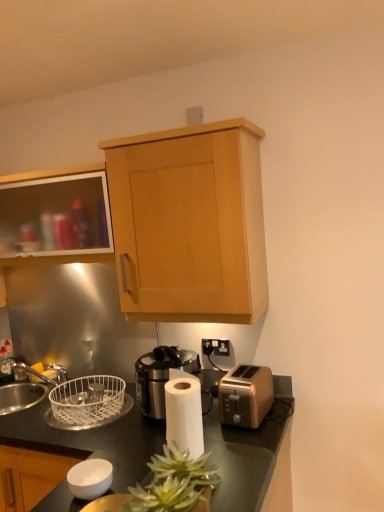
Question: Is matte glass cabinet at upper left, which appears as the first cabinetry when viewed from the left, taller than light wood cabinet at upper center, the 1th cabinetry positioned from the right?

Choices:
 (A) no
 (B) yes

Answer: (A)

Question: Does matte glass cabinet at upper left, which ranks as the 2th cabinetry in right-to-left order, turn towards light wood cabinet at upper center, marked as the 2th cabinetry in a left-to-right arrangement?

Choices:
 (A) yes
 (B) no

Answer: (B)

Question: Is matte glass cabinet at upper left, which appears as the first cabinetry when viewed from the left, not close to light wood cabinet at upper center, marked as the 2th cabinetry in a left-to-right arrangement?

Choices:
 (A) no
 (B) yes

Answer: (A)

Question: Considering the relative sizes of matte glass cabinet at upper left, which appears as the first cabinetry when viewed from the left, and light wood cabinet at upper center, marked as the 2th cabinetry in a left-to-right arrangement, in the image provided, is matte glass cabinet at upper left, which appears as the first cabinetry when viewed from the left, thinner than light wood cabinet at upper center, marked as the 2th cabinetry in a left-to-right arrangement,?

Choices:
 (A) yes
 (B) no

Answer: (A)

Question: Can you confirm if matte glass cabinet at upper left, which ranks as the 2th cabinetry in right-to-left order, is smaller than light wood cabinet at upper center, the 1th cabinetry positioned from the right?

Choices:
 (A) yes
 (B) no

Answer: (A)

Question: From a real-world perspective, is black plastic electrical outlet at center physically located above or below black glossy countertop at center?

Choices:
 (A) below
 (B) above

Answer: (B)

Question: Visually, is black plastic electrical outlet at center positioned to the left or to the right of black glossy countertop at center?

Choices:
 (A) left
 (B) right

Answer: (B)

Question: From the image's perspective, is black plastic electrical outlet at center above or below black glossy countertop at center?

Choices:
 (A) below
 (B) above

Answer: (B)

Question: Considering the positions of point (228, 350) and point (129, 450), is point (228, 350) closer or farther from the camera than point (129, 450)?

Choices:
 (A) farther
 (B) closer

Answer: (A)

Question: Is gold metallic toaster at lower right taller or shorter than black metallic coffee machine at center?

Choices:
 (A) tall
 (B) short

Answer: (B)

Question: Is gold metallic toaster at lower right bigger or smaller than black metallic coffee machine at center?

Choices:
 (A) small
 (B) big

Answer: (A)

Question: From the image's perspective, relative to black metallic coffee machine at center, is gold metallic toaster at lower right above or below?

Choices:
 (A) above
 (B) below

Answer: (B)

Question: Looking at their shapes, would you say gold metallic toaster at lower right is wider or thinner than black metallic coffee machine at center?

Choices:
 (A) wide
 (B) thin

Answer: (A)

Question: In terms of width, does light wood cabinet at upper center, the 1th cabinetry positioned from the right, look wider or thinner when compared to gold metallic toaster at lower right?

Choices:
 (A) thin
 (B) wide

Answer: (B)

Question: In terms of height, does light wood cabinet at upper center, the 1th cabinetry positioned from the right, look taller or shorter compared to gold metallic toaster at lower right?

Choices:
 (A) tall
 (B) short

Answer: (A)